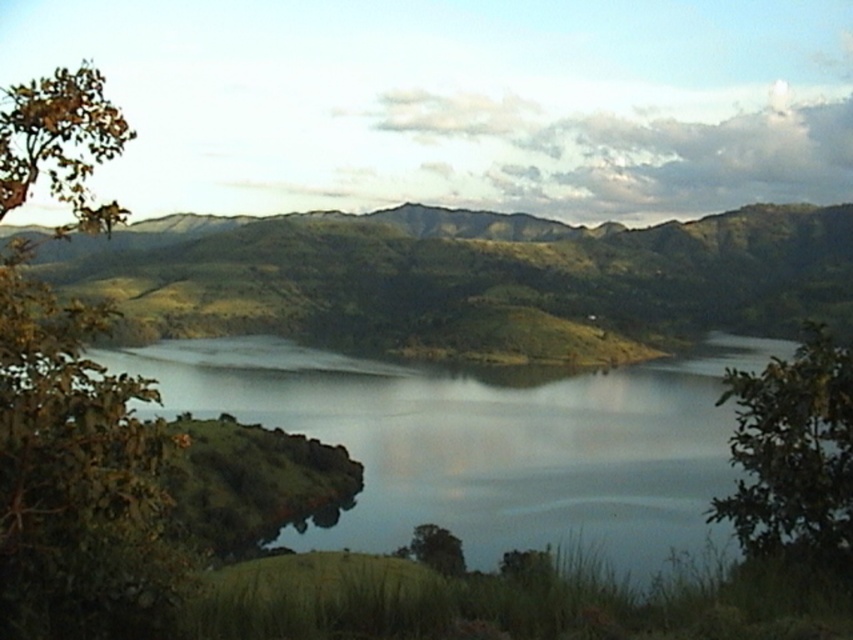
Question: Does brown leafy tree at left appear over green leafy tree at lower right?

Choices:
 (A) yes
 (B) no

Answer: (A)

Question: Is green grassy hill at center positioned at the back of green leafy tree at lower right?

Choices:
 (A) yes
 (B) no

Answer: (A)

Question: Considering the real-world distances, which object is closest to the transparent water at center?

Choices:
 (A) green matte tree at center
 (B) brown leafy tree at left

Answer: (A)

Question: Is brown leafy tree at left smaller than green leafy tree at lower right?

Choices:
 (A) yes
 (B) no

Answer: (B)

Question: Which point is farther from the camera taking this photo?

Choices:
 (A) (433, 544)
 (B) (685, 392)
 (C) (10, 561)

Answer: (B)

Question: Which object appears closest to the camera in this image?

Choices:
 (A) green leafy tree at lower right
 (B) brown leafy tree at left
 (C) transparent water at center
 (D) green matte tree at center

Answer: (B)